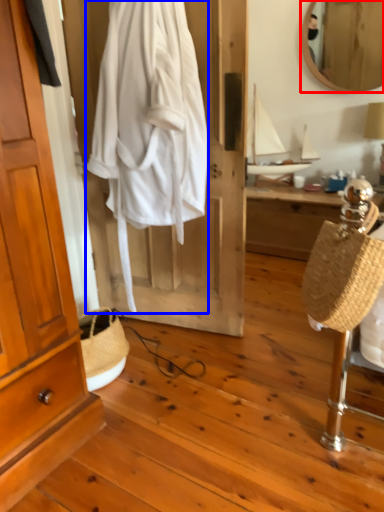
Question: Among these objects, which one is farthest to the camera, mirror (highlighted by a red box) or clothing (highlighted by a blue box)?

Choices:
 (A) mirror
 (B) clothing

Answer: (A)